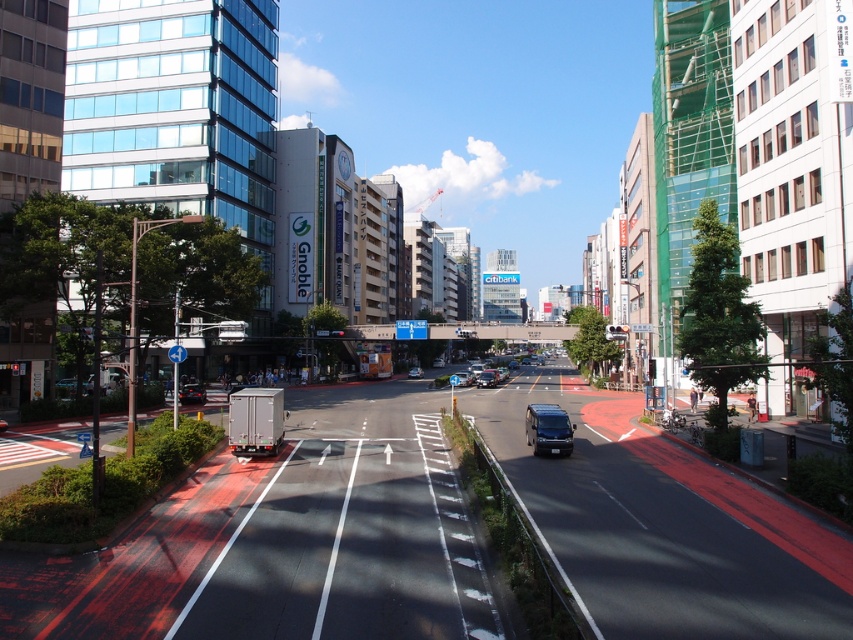
You are a pedestrian standing at the crosswalk and want to cross the street. You see a metallic silver van at center and a matte black van at center. Which van is blocking your view of the other?

The metallic silver van at center is positioned over the matte black van at center, so it is blocking the view of the matte black van at center.

You are a delivery person who needs to park your vehicle in a low clearance garage that can only accommodate vehicles shorter than 1.8 meters. You have a metallic silver van at center and a shiny black car at lower left. Which vehicle should you choose to park in the garage?

The shiny black car at lower left should be chosen because the metallic silver van at center has a greater height and may not fit in the low clearance garage.

You are a delivery driver who needs to park your vehicle in a parking spot that can only accommodate cars up to the size of the silver metallic sedan at center. You have a car similar in size to the shiny black car at lower left. Will your car fit in the parking spot?

The shiny black car at lower left is wider than the silver metallic sedan at center. Since the parking spot can only accommodate cars up to the size of the silver metallic sedan at center, your car, which is wider, will not fit in the parking spot.